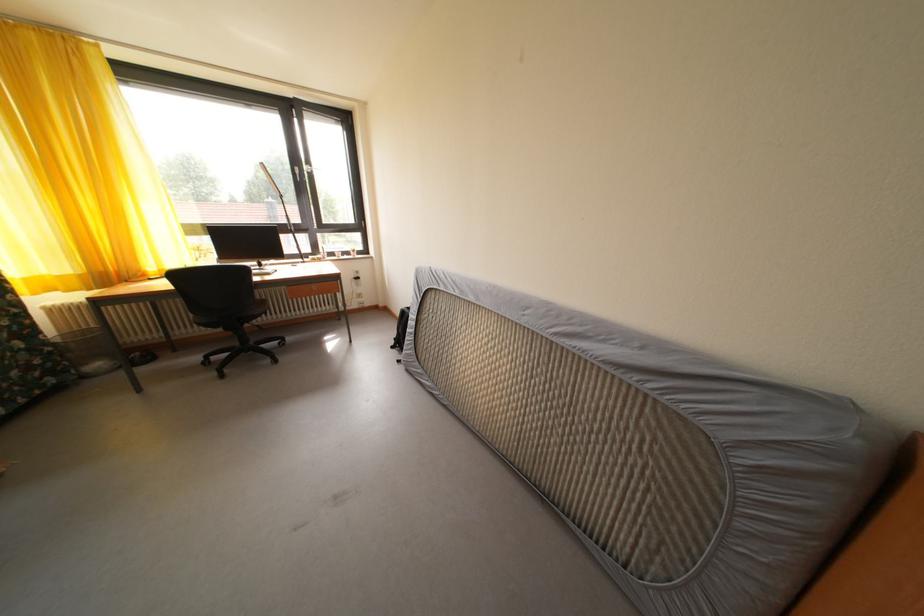
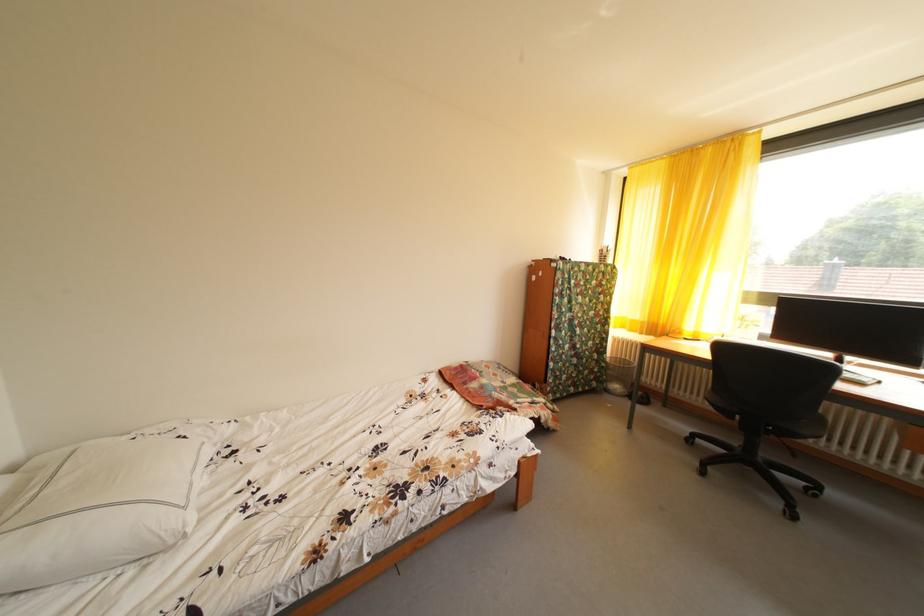
Question: The first image is from the beginning of the video and the second image is from the end. How did the camera likely rotate when shooting the video?

Choices:
 (A) Left
 (B) Right
 (C) Up
 (D) Down

Answer: (A)